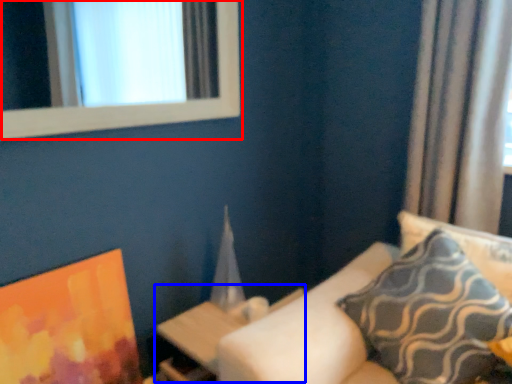
Question: Which of the following is the farthest to the observer, window (highlighted by a red box) or table (highlighted by a blue box)?

Choices:
 (A) window
 (B) table

Answer: (B)